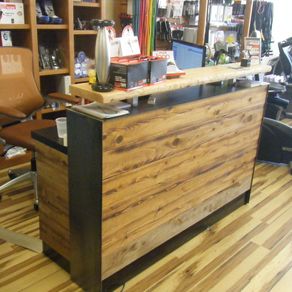
This screenshot has width=292, height=292. I want to click on plastic cup, so click(60, 128).